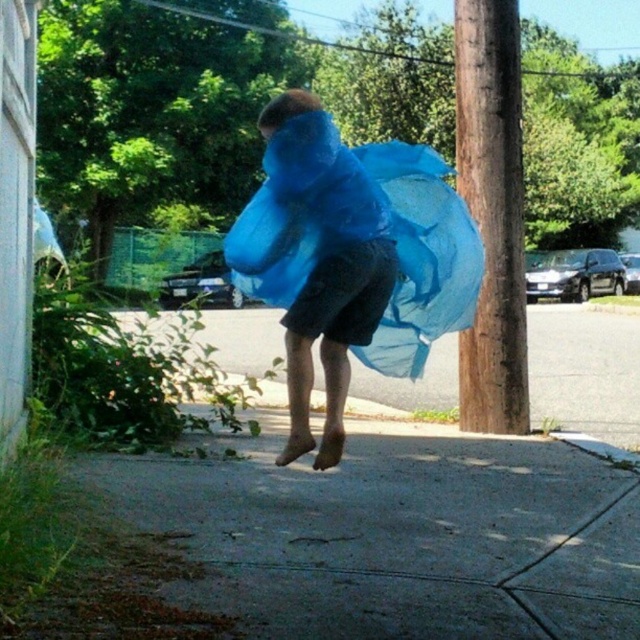
Can you confirm if brown rough wood pole at center right is positioned above blue translucent fabric at center?

Yes.

Between brown rough wood pole at center right and blue translucent fabric at center, which one has less height?

blue translucent fabric at center

Which is in front, point (480, 33) or point (292, 376)?

Point (292, 376) is in front.

I want to click on brown rough wood pole at center right, so click(492, 212).

Can you confirm if gray concrete pavement at lower center is wider than blue sheer fabric at center?

Indeed, gray concrete pavement at lower center has a greater width compared to blue sheer fabric at center.

Can you confirm if gray concrete pavement at lower center is shorter than blue sheer fabric at center?

Yes.

Locate an element on the screen. The height and width of the screenshot is (640, 640). gray concrete pavement at lower center is located at coordinates (397, 534).

Identify the location of gray concrete pavement at lower center. The height and width of the screenshot is (640, 640). (397, 534).

Is point (262, 132) in front of point (371, 266)?

No.

Is blue translucent fabric at center to the right of blue sheer fabric at center from the viewer's perspective?

Incorrect, blue translucent fabric at center is not on the right side of blue sheer fabric at center.

Who is more forward, (276,120) or (358,282)?

Point (276,120) is in front.

Identify the location of blue translucent fabric at center. The width and height of the screenshot is (640, 640). (330, 278).